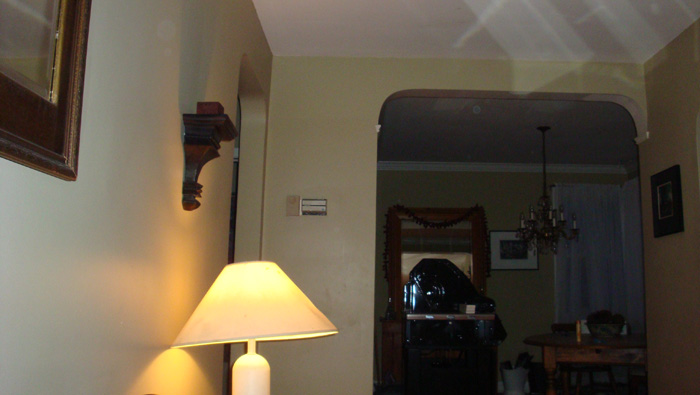
You are a GUI agent. You are given a task and a screenshot of the screen. Output one action in this format:
    pyautogui.click(x=<x>, y=<y>)
    Task: Click on the thermostat
    The height and width of the screenshot is (395, 700).
    Given the screenshot: What is the action you would take?
    pyautogui.click(x=313, y=209)